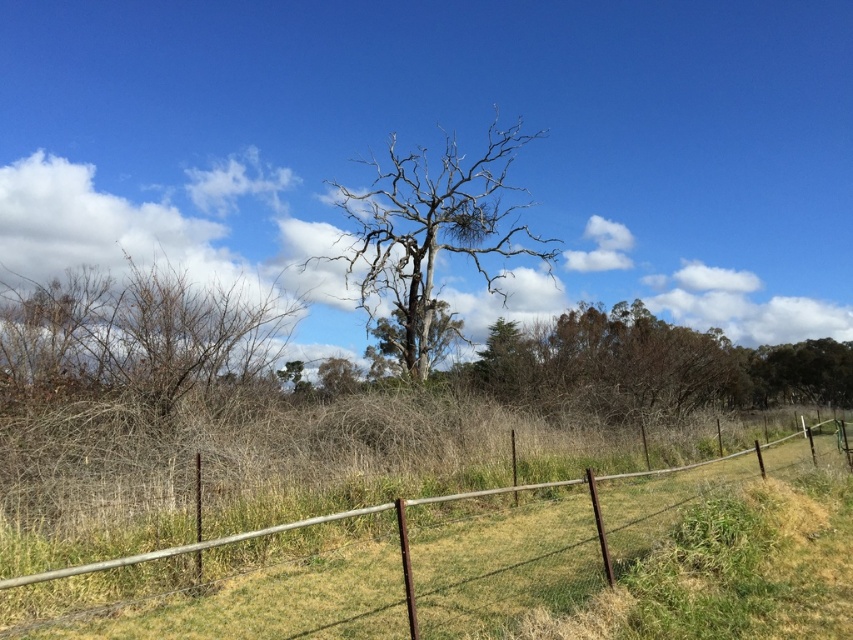
From the picture: You are a hiker trying to navigate through the rural landscape. You see the brown wire fence at center and the brown dry bush at left. Which object is positioned to the right of the other?

The brown wire fence at center is to the right of the brown dry bush at left.

You are a bird looking for a nesting spot. You see the bare wood tree at center and the green leafy tree at right. Which tree would you choose if you prefer a larger tree for nesting?

The bare wood tree at center is bigger than the green leafy tree at right, so the bird should choose the bare wood tree at center for nesting.